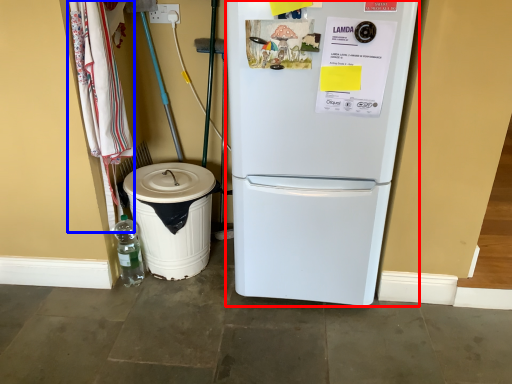
Question: Which point is further to the camera, refrigerator (highlighted by a red box) or laundry (highlighted by a blue box)?

Choices:
 (A) refrigerator
 (B) laundry

Answer: (B)